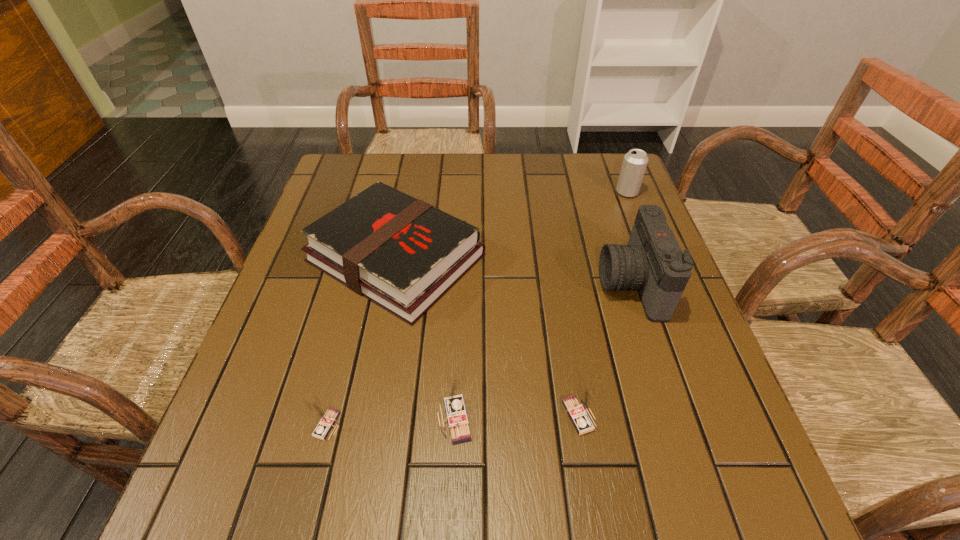
All matchboxs are currently evenly spaced. To continue this pattern, where would you add another matchbox on the right? Please point out a vacant spot. Please provide its 2D coordinates. Your answer should be formatted as a tuple, i.e. [(x, y)], where the tuple contains the x and y coordinates of a point satisfying the conditions above.

[(702, 411)]